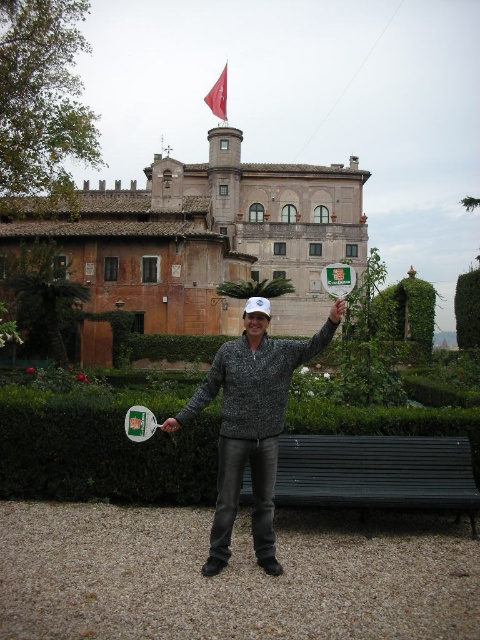
Question: Is speckled sweater at center in front of red fabric flag at upper center?

Choices:
 (A) yes
 (B) no

Answer: (A)

Question: Does brown stone building at upper center appear under speckled sweater at center?

Choices:
 (A) no
 (B) yes

Answer: (A)

Question: Is speckled sweater at center to the left of black metal bench at lower center from the viewer's perspective?

Choices:
 (A) no
 (B) yes

Answer: (B)

Question: Which point is farther to the camera?

Choices:
 (A) (66, 221)
 (B) (458, 451)
 (C) (475, 294)

Answer: (A)

Question: Which point is farther from the camera taking this photo?

Choices:
 (A) (276, 380)
 (B) (277, 220)
 (C) (423, 445)

Answer: (B)

Question: Which point is closer to the camera taking this photo?

Choices:
 (A) (468, 275)
 (B) (223, 536)

Answer: (B)